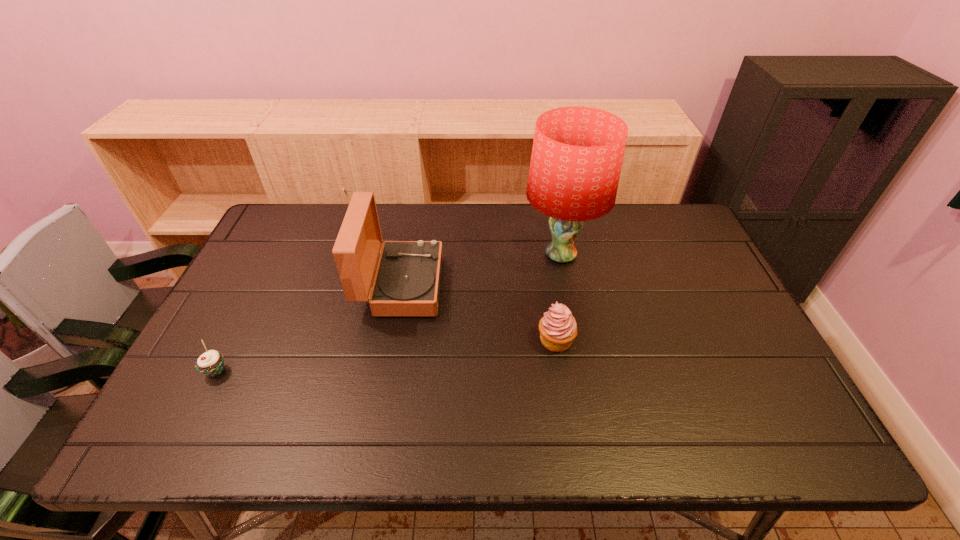
Where is `lampshade`? The image size is (960, 540). lampshade is located at coordinates (577, 154).

Locate an element on the screen. The height and width of the screenshot is (540, 960). the second object from left to right is located at coordinates (407, 281).

This screenshot has width=960, height=540. What are the coordinates of `phonograph record` in the screenshot? It's located at (407, 281).

Locate an element on the screen. the third farthest object is located at coordinates [557, 327].

Where is `the taller cupcake`? This screenshot has height=540, width=960. the taller cupcake is located at coordinates (557, 327).

Where is `the nearest object`? This screenshot has width=960, height=540. the nearest object is located at coordinates (211, 363).

The height and width of the screenshot is (540, 960). I want to click on the nearer cupcake, so click(211, 363).

Find the location of `vacant space situated 0.290m on the front-facing side of the lampshade`. vacant space situated 0.290m on the front-facing side of the lampshade is located at coordinates (428, 254).

At what (x,y) coordinates should I click in order to perform the action: click on free point located on the front-facing side of the lampshade. Please return your answer as a coordinate pair (x, y). The image size is (960, 540). Looking at the image, I should click on (464, 254).

Locate an element on the screen. The width and height of the screenshot is (960, 540). vacant region located 0.290m on the front-facing side of the lampshade is located at coordinates (428, 254).